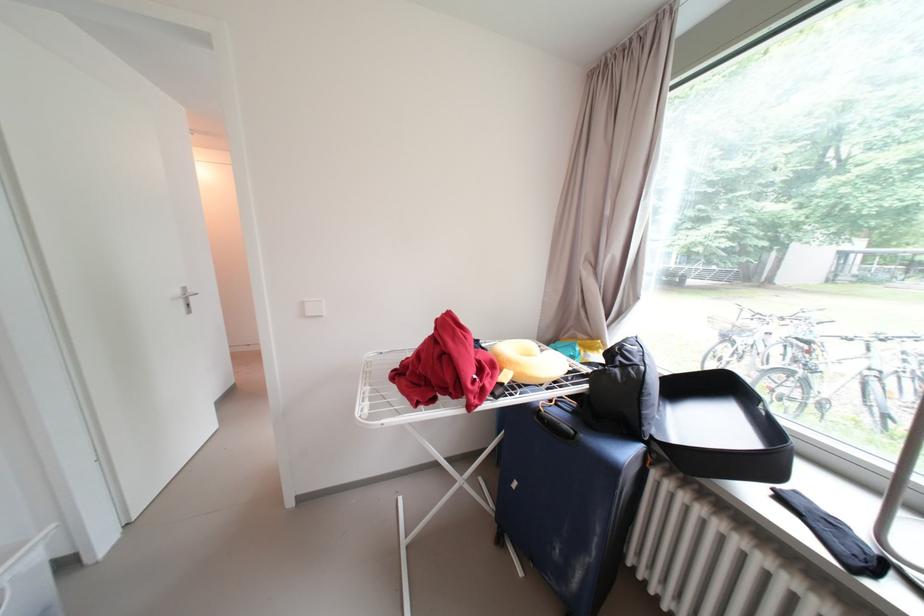
Locate an element on the screen. This screenshot has height=616, width=924. black backpack is located at coordinates (623, 391).